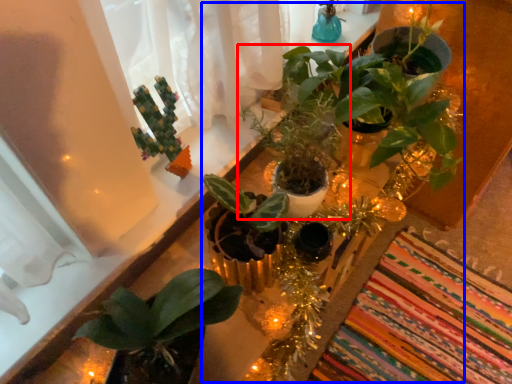
Question: Which point is closer to the camera, houseplant (highlighted by a red box) or floral arrangement (highlighted by a blue box)?

Choices:
 (A) houseplant
 (B) floral arrangement

Answer: (B)